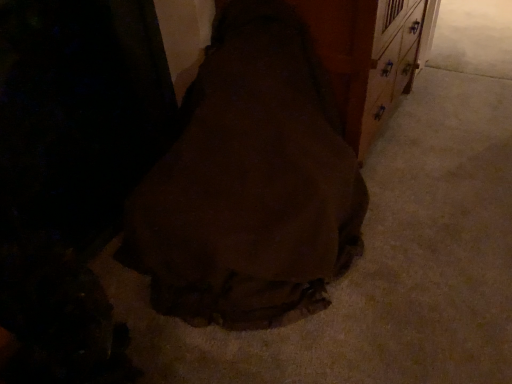
The height and width of the screenshot is (384, 512). What do you see at coordinates (370, 56) in the screenshot? I see `brown wood dresser at center` at bounding box center [370, 56].

This screenshot has width=512, height=384. Identify the location of brown wood dresser at center. (370, 56).

Locate an element on the screen. brown fabric bag at center is located at coordinates (250, 183).

What do you see at coordinates (250, 183) in the screenshot? The height and width of the screenshot is (384, 512). I see `brown fabric bag at center` at bounding box center [250, 183].

I want to click on brown wood dresser at center, so click(x=370, y=56).

Can you confirm if brown fabric bag at center is positioned to the left of brown wood dresser at center?

Yes.

Which object is further away from the camera, brown fabric bag at center or brown wood dresser at center?

brown wood dresser at center.

Considering the points (312, 245) and (367, 131), which point is behind, point (312, 245) or point (367, 131)?

The point (367, 131) is farther from the camera.

From the image's perspective, is brown fabric bag at center over brown wood dresser at center?

No.

From a real-world perspective, is brown fabric bag at center physically located above or below brown wood dresser at center?

brown fabric bag at center is situated higher than brown wood dresser at center in the real world.

Which object is wider, brown fabric bag at center or brown wood dresser at center?

brown fabric bag at center is wider.

Who is shorter, brown fabric bag at center or brown wood dresser at center?

brown wood dresser at center.

Which of these two, brown fabric bag at center or brown wood dresser at center, is smaller?

Smaller between the two is brown wood dresser at center.

Is brown fabric bag at center inside or outside of brown wood dresser at center?

brown fabric bag at center exists outside the volume of brown wood dresser at center.

Is brown fabric bag at center not close to brown wood dresser at center?

No, brown fabric bag at center is not far from brown wood dresser at center.

Is brown fabric bag at center positioned with its back to brown wood dresser at center?

Yes.

How different are the orientations of brown fabric bag at center and brown wood dresser at center in degrees?

The facing directions of brown fabric bag at center and brown wood dresser at center are 90 degrees apart.

In the image, there is a brown fabric bag at center. At what (x,y) coordinates should I click in order to perform the action: click on dresser above it (from the image's perspective). Please return your answer as a coordinate pair (x, y). This screenshot has width=512, height=384. Looking at the image, I should click on [370, 56].

Which is more to the right, brown wood dresser at center or brown fabric bag at center?

Positioned to the right is brown wood dresser at center.

Considering the positions of objects brown wood dresser at center and brown fabric bag at center in the image provided, who is in front, brown wood dresser at center or brown fabric bag at center?

brown fabric bag at center is more forward.

From the picture: Which point is more forward, (408,59) or (212,62)?

The point (212,62) is in front.

From the image's perspective, does brown wood dresser at center appear higher than brown fabric bag at center?

Yes, from the image's perspective, brown wood dresser at center is over brown fabric bag at center.

From a real-world perspective, is brown wood dresser at center beneath brown fabric bag at center?

Indeed, from a real-world perspective, brown wood dresser at center is positioned beneath brown fabric bag at center.

Is brown wood dresser at center wider than brown fabric bag at center?

Incorrect, the width of brown wood dresser at center does not surpass that of brown fabric bag at center.

In terms of height, does brown wood dresser at center look taller or shorter compared to brown fabric bag at center?

Considering their sizes, brown wood dresser at center has less height than brown fabric bag at center.

Between brown wood dresser at center and brown fabric bag at center, which one has larger size?

brown fabric bag at center is bigger.

Is brown fabric bag at center located within brown wood dresser at center?

Definitely not — brown fabric bag at center is not inside brown wood dresser at center.

Are brown wood dresser at center and brown fabric bag at center located far from each other?

No, brown wood dresser at center is not far away from brown fabric bag at center.

Could you tell me if brown wood dresser at center is turned towards brown fabric bag at center?

No, brown wood dresser at center is not turned towards brown fabric bag at center.

How much distance is there between brown wood dresser at center and brown fabric bag at center?

brown wood dresser at center is 49.22 centimeters away from brown fabric bag at center.

The image size is (512, 384). In order to click on fancy dress in front of the brown wood dresser at center in this screenshot , I will do `click(250, 183)`.

This screenshot has height=384, width=512. I want to click on dresser directly beneath the brown fabric bag at center (from a real-world perspective), so click(370, 56).

I want to click on fancy dress below the brown wood dresser at center (from the image's perspective), so click(x=250, y=183).